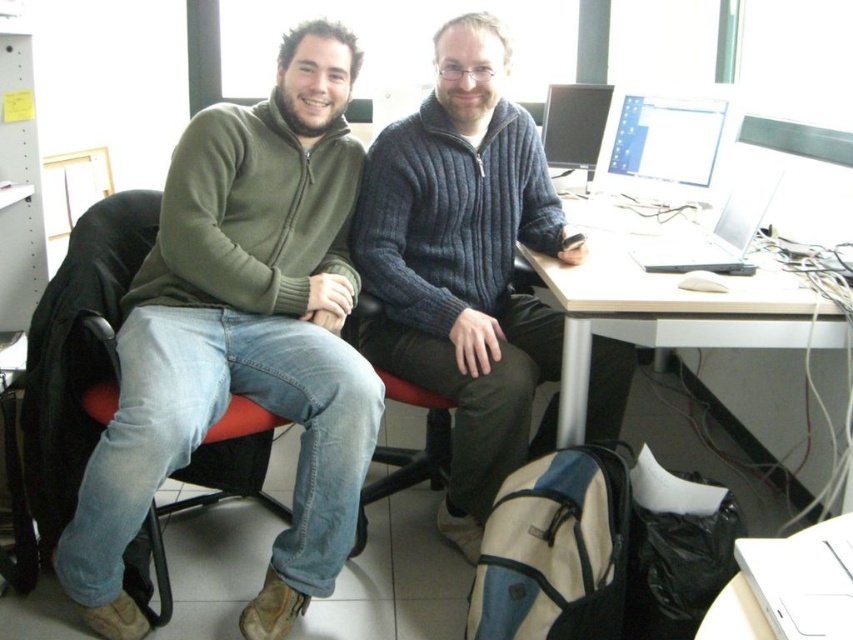
Does red fabric chair at center appear on the right side of white plastic computer desk at lower right?

In fact, red fabric chair at center is to the left of white plastic computer desk at lower right.

Does point (532, 449) come in front of point (587, 353)?

No, (532, 449) is behind (587, 353).

Find the location of a particular element. The image size is (853, 640). red fabric chair at center is located at coordinates (450, 416).

Between knitted sweater at center and matte black monitor at center, which one appears on the right side from the viewer's perspective?

matte black monitor at center

Does point (396, 216) come in front of point (572, 104)?

Yes, it is in front of point (572, 104).

Between point (474, 552) and point (596, 97), which one is positioned behind?

The point (596, 97) is behind.

At what (x,y) coordinates should I click in order to perform the action: click on knitted sweater at center. Please return your answer as a coordinate pair (x, y). The image size is (853, 640). Looking at the image, I should click on (463, 266).

Is the position of green matte sweater at left more distant than that of white plastic computer desk at lower right?

No, green matte sweater at left is in front of white plastic computer desk at lower right.

Who is more distant from viewer, (329, 58) or (631, 301)?

Positioned behind is point (329, 58).

Where is `green matte sweater at left`? The image size is (853, 640). green matte sweater at left is located at coordinates (242, 337).